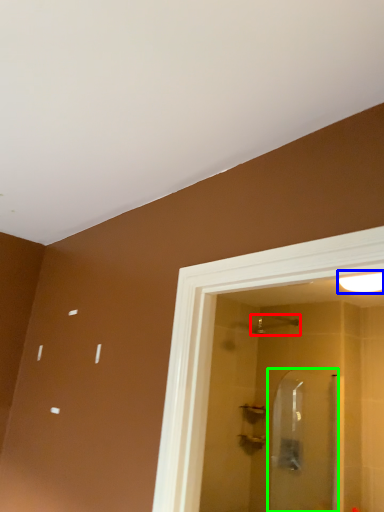
Question: Based on their relative distances, which object is nearer to shower (highlighted by a red box)? Choose from light fixture (highlighted by a blue box) and screen door (highlighted by a green box).

Choices:
 (A) light fixture
 (B) screen door

Answer: (B)